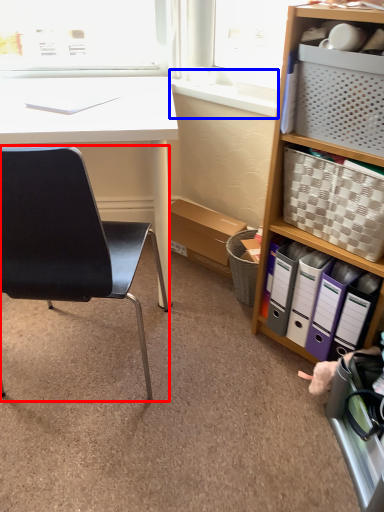
Question: Which point is further to the camera, chair (highlighted by a red box) or window sill (highlighted by a blue box)?

Choices:
 (A) chair
 (B) window sill

Answer: (B)